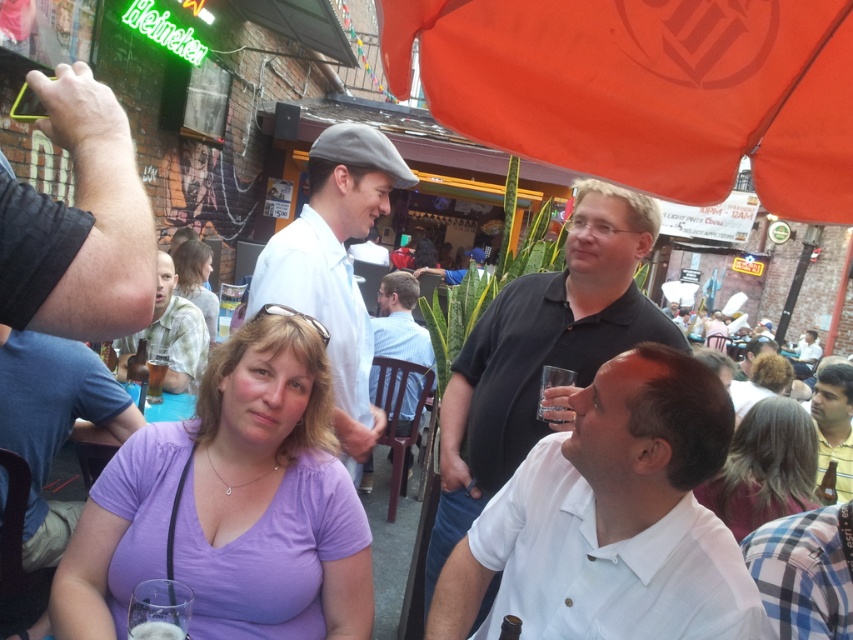
Question: Is white matte shirt at center further to the viewer compared to light blue shirt at center?

Choices:
 (A) no
 (B) yes

Answer: (A)

Question: Which object is the farthest from the clear plastic cup at lower right?

Choices:
 (A) dark brown leather arm at upper left
 (B) light blue shirt at center

Answer: (A)

Question: Which object is positioned farthest from the light green shirt at center?

Choices:
 (A) clear plastic cup at lower left
 (B) orange fabric umbrella at upper center
 (C) purple cotton shirt at lower left
 (D) blonde hair at lower right

Answer: (D)

Question: Considering the relative positions of light blue shirt at center and clear glass at lower left in the image provided, where is light blue shirt at center located with respect to clear glass at lower left?

Choices:
 (A) left
 (B) right

Answer: (B)

Question: Can you confirm if blonde hair at lower right is bigger than blonde hair at center?

Choices:
 (A) yes
 (B) no

Answer: (B)

Question: Which object is farther from the camera taking this photo?

Choices:
 (A) dark brown leather arm at upper left
 (B) clear glass at lower left
 (C) clear plastic cup at lower left
 (D) white matte shirt at center

Answer: (C)